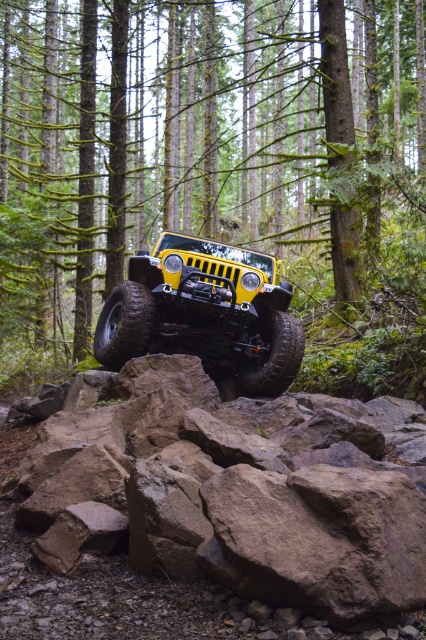
Who is lower down, green mossy tree trunk at center or yellow matte/soft jeep at center?

Positioned lower is yellow matte/soft jeep at center.

Is green mossy tree trunk at center smaller than yellow matte/soft jeep at center?

No, green mossy tree trunk at center is not smaller than yellow matte/soft jeep at center.

Find the location of a particular element. green mossy tree trunk at center is located at coordinates (204, 140).

Can you confirm if green mossy tree trunk at center is shorter than brown rough rock at center?

No.

Between point (32, 10) and point (34, 493), which one is positioned behind?

The point (32, 10) is more distant.

This screenshot has height=640, width=426. Describe the element at coordinates (204, 140) in the screenshot. I see `green mossy tree trunk at center` at that location.

The width and height of the screenshot is (426, 640). Find the location of `green mossy tree trunk at center`. green mossy tree trunk at center is located at coordinates click(204, 140).

Is brown rough rock at center closer to the viewer compared to yellow matte/soft jeep at center?

Yes, brown rough rock at center is in front of yellow matte/soft jeep at center.

Which is below, brown rough rock at center or yellow matte/soft jeep at center?

Positioned lower is brown rough rock at center.

Locate an element on the screen. Image resolution: width=426 pixels, height=640 pixels. brown rough rock at center is located at coordinates (227, 492).

You are a GUI agent. You are given a task and a screenshot of the screen. Output one action in this format:
    pyautogui.click(x=<x>, y=<y>)
    Task: Click on the brown rough rock at center
    
    Given the screenshot: What is the action you would take?
    (x=227, y=492)